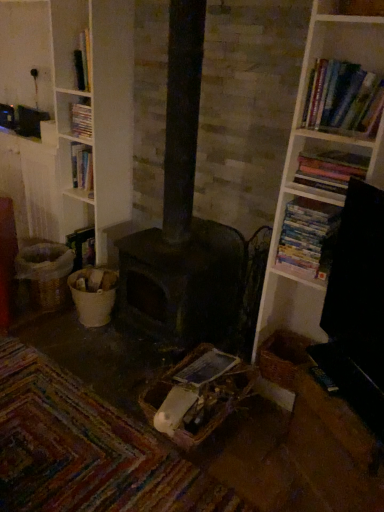
In order to click on blank space situated above dark matte heater at center (from a real-world perspective) in this screenshot , I will do `click(215, 217)`.